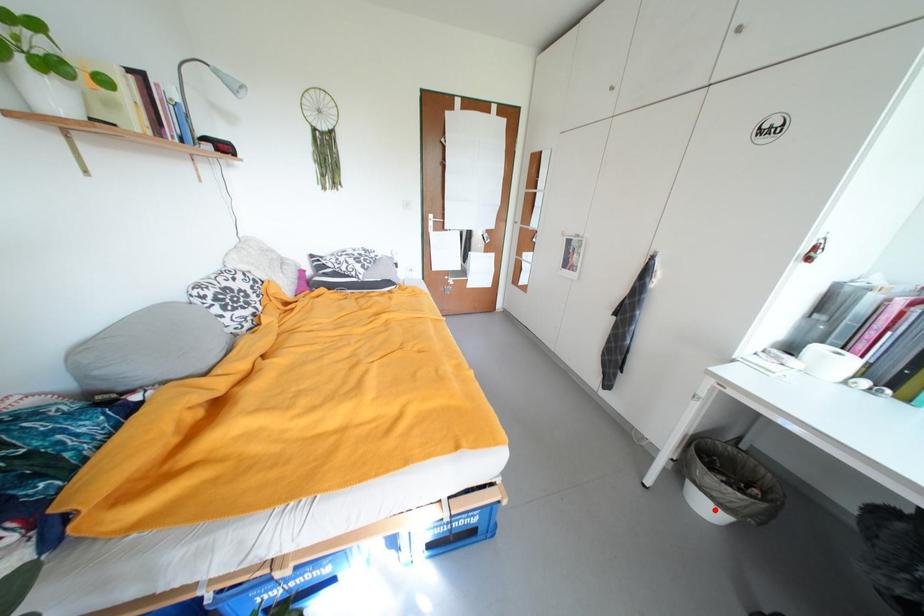
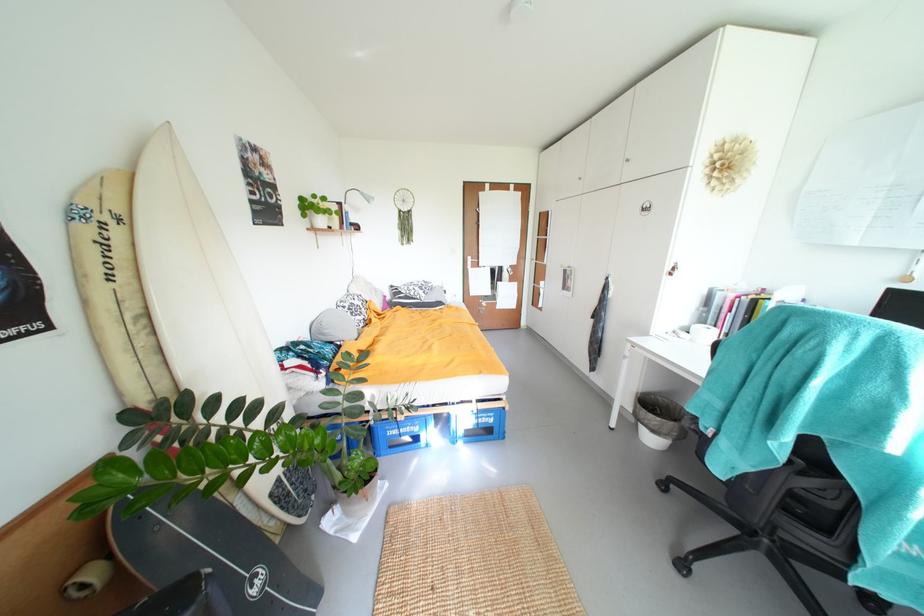
Where in the second image is the point corresponding to the highlighted location from the first image?

(659, 442)